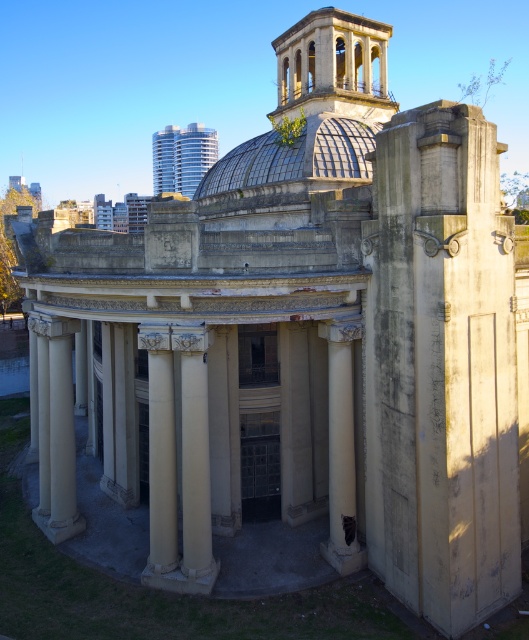
Question: Is matte glass dome at upper center wider than white stone column at center?

Choices:
 (A) yes
 (B) no

Answer: (A)

Question: Does beige stone column at right have a greater width compared to matte glass dome at upper center?

Choices:
 (A) yes
 (B) no

Answer: (B)

Question: Can you confirm if beige stone column at right is bigger than matte glass dome at upper center?

Choices:
 (A) no
 (B) yes

Answer: (A)

Question: Which of these objects is positioned farthest from the white stone column at center?

Choices:
 (A) matte glass dome at upper center
 (B) beige stone column at right

Answer: (A)

Question: Which is nearer to the matte glass dome at upper center?

Choices:
 (A) beige stone column at right
 (B) white stone column at center

Answer: (A)

Question: Which is nearer to the white stone column at center?

Choices:
 (A) beige stone column at right
 (B) matte glass dome at upper center

Answer: (A)